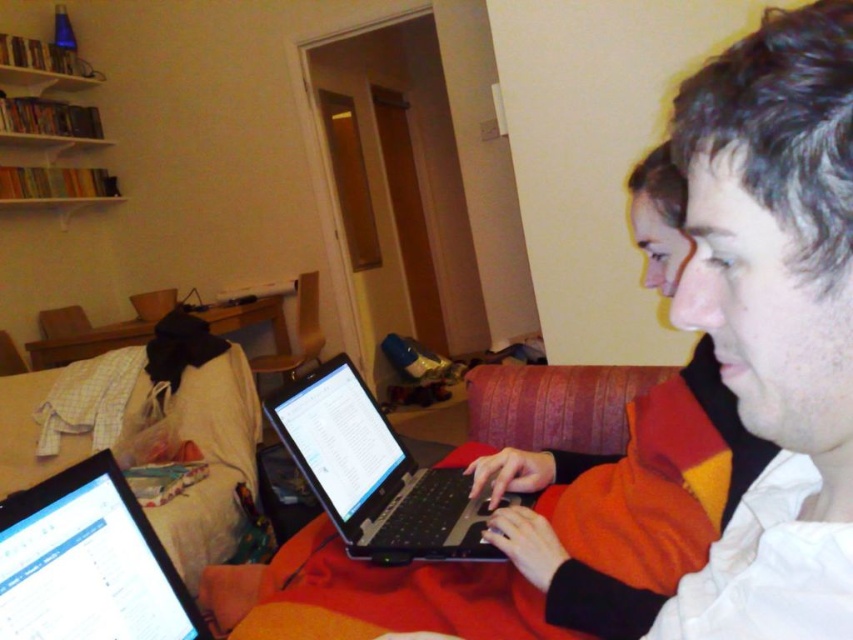
Can you confirm if matte black laptop at center is wider than velvet-like orange couch at center?

No.

Does point (747, 211) lie in front of point (605, 550)?

Yes, it is.

The height and width of the screenshot is (640, 853). In order to click on matte black laptop at center in this screenshot , I will do `click(679, 410)`.

Can you confirm if matte black laptop at center is positioned to the right of black plastic laptop at center?

Indeed, matte black laptop at center is positioned on the right side of black plastic laptop at center.

Is matte black laptop at center thinner than black plastic laptop at center?

No, matte black laptop at center is not thinner than black plastic laptop at center.

Locate an element on the screen. The width and height of the screenshot is (853, 640). matte black laptop at center is located at coordinates (679, 410).

Who is lower down, velvet-like orange couch at center or black plastic laptop at center?

Positioned lower is velvet-like orange couch at center.

Is point (668, 408) farther from viewer compared to point (373, 413)?

That is False.

Between point (341, 602) and point (440, 548), which one is positioned in front?

Point (341, 602)

Locate an element on the screen. velvet-like orange couch at center is located at coordinates (387, 596).